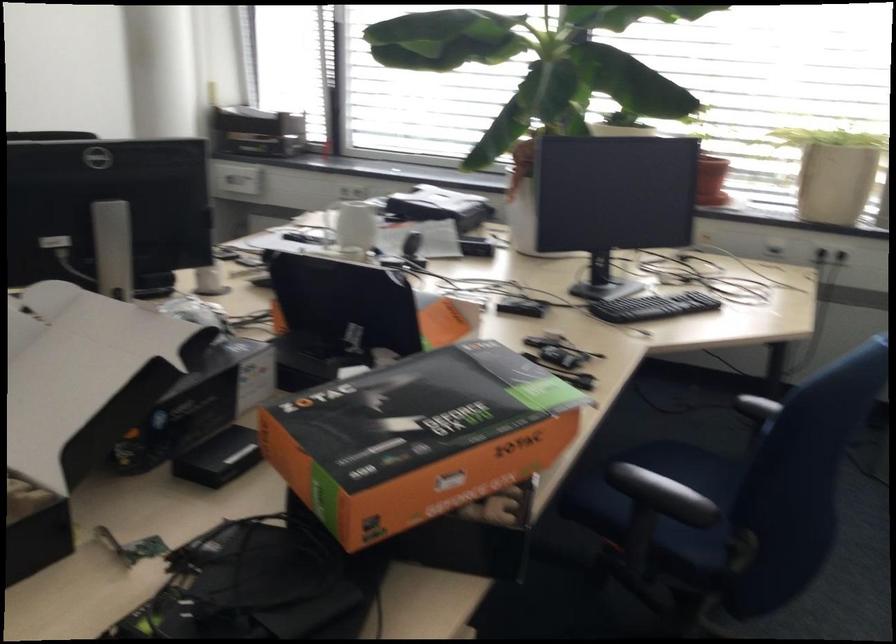
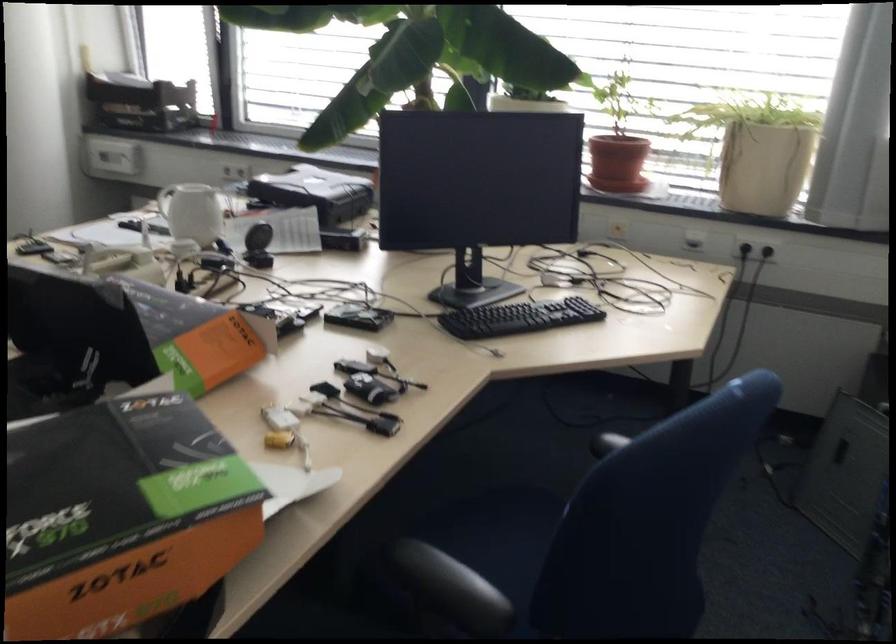
Question: Based on the continuous images, in which direction is the camera rotating? Reply with the corresponding letter.

Choices:
 (A) Left
 (B) Right
 (C) Up
 (D) Down

Answer: (D)